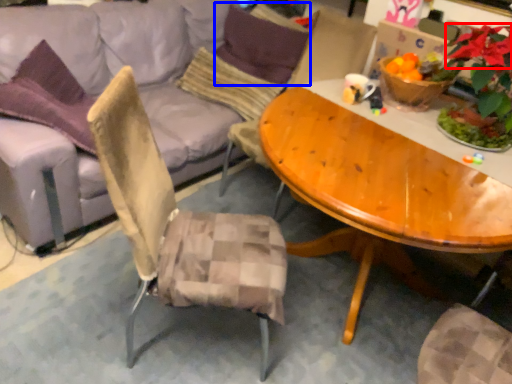
Question: Which object is closer to the camera taking this photo, flower (highlighted by a red box) or pillow (highlighted by a blue box)?

Choices:
 (A) flower
 (B) pillow

Answer: (A)